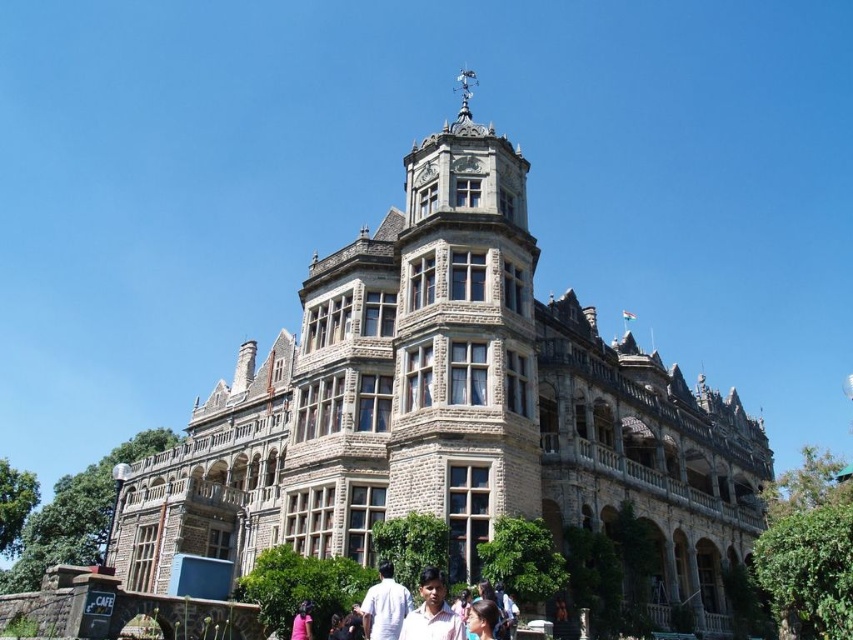
You are a photographer standing at the base of the grand stone building. You see a pink fabric shirt at center and a pink fabric at lower center. If you want to take a photo that includes both items in the frame, will you need to zoom in or zoom out?

The pink fabric shirt at center and pink fabric at lower center are 14.08 meters apart. To include both items in the frame, you would need to zoom out to capture the wider angle required to fit the 14.08 meters distance between them.

You are standing in a field 100 feet away from a stone castle at center. Can you see the decorative stonework on its pointed roof?

The stone castle at center is 142.12 feet from the viewer, so you are actually 42.12 feet further away than you think. Therefore, you cannot clearly see the decorative stonework on its pointed roof from your current position.